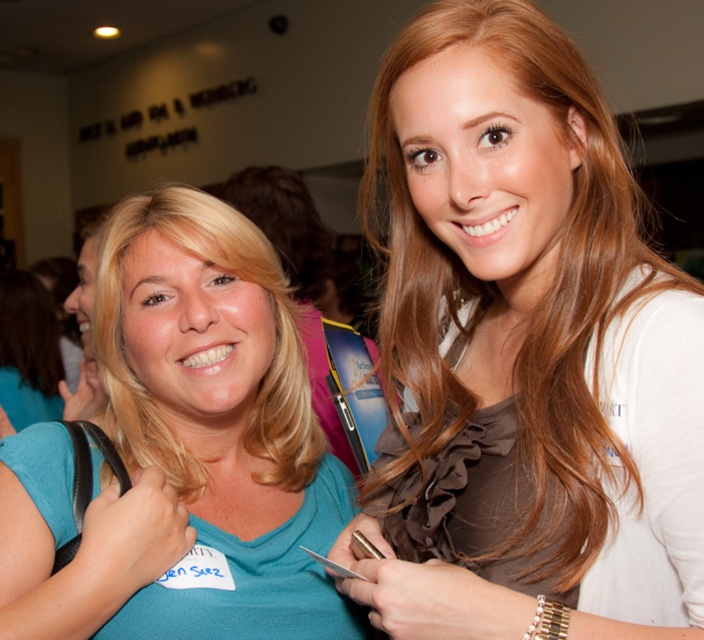
Question: Can you confirm if teal matte shirt at center is bigger than blonde hair at left?

Choices:
 (A) yes
 (B) no

Answer: (B)

Question: Which point is closer to the camera taking this photo?

Choices:
 (A) (6, 556)
 (B) (662, 289)

Answer: (B)

Question: Is teal matte shirt at center further to camera compared to blonde hair at left?

Choices:
 (A) yes
 (B) no

Answer: (B)

Question: Which of these objects is positioned farthest from the blonde hair at left?

Choices:
 (A) teal matte shirt at center
 (B) matte brown blouse at center

Answer: (B)

Question: Which object is closer to the camera taking this photo?

Choices:
 (A) blonde hair at left
 (B) matte brown blouse at center
 (C) teal matte shirt at center

Answer: (B)

Question: Does matte brown blouse at center appear under teal matte shirt at center?

Choices:
 (A) no
 (B) yes

Answer: (A)